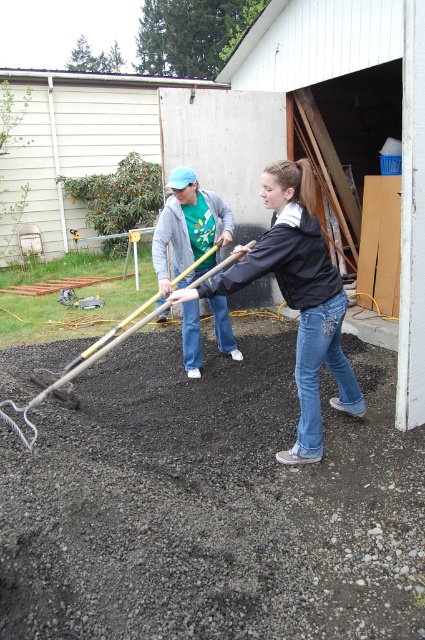
I want to click on denim jeans at center, so click(x=297, y=298).

Is point (277, 282) less distant than point (147, 323)?

Yes, it is in front of point (147, 323).

The width and height of the screenshot is (425, 640). Identify the location of denim jeans at center. (297, 298).